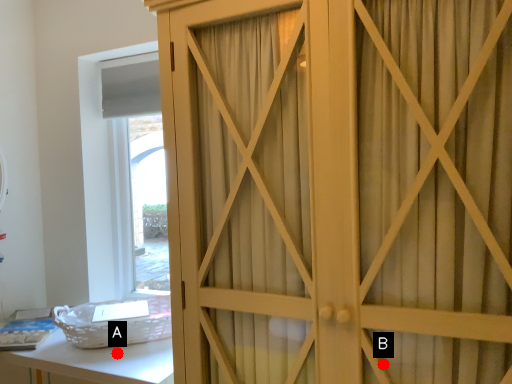
Question: Two points are circled on the image, labeled by A and B beside each circle. Which point appears closest to the camera in this image?

Choices:
 (A) A is closer
 (B) B is closer

Answer: (B)